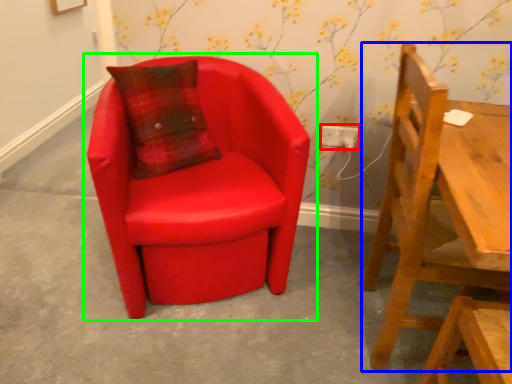
Question: Considering the real-world distances, which object is farthest from electric outlet (highlighted by a red box)? chair (highlighted by a blue box) or chair (highlighted by a green box)?

Choices:
 (A) chair
 (B) chair

Answer: (A)